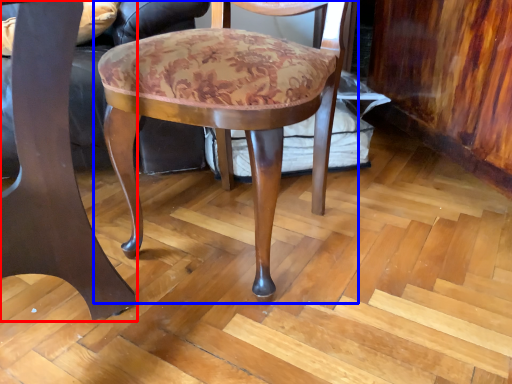
Question: Which of the following is the farthest to the observer, chair (highlighted by a red box) or chair (highlighted by a blue box)?

Choices:
 (A) chair
 (B) chair

Answer: (B)